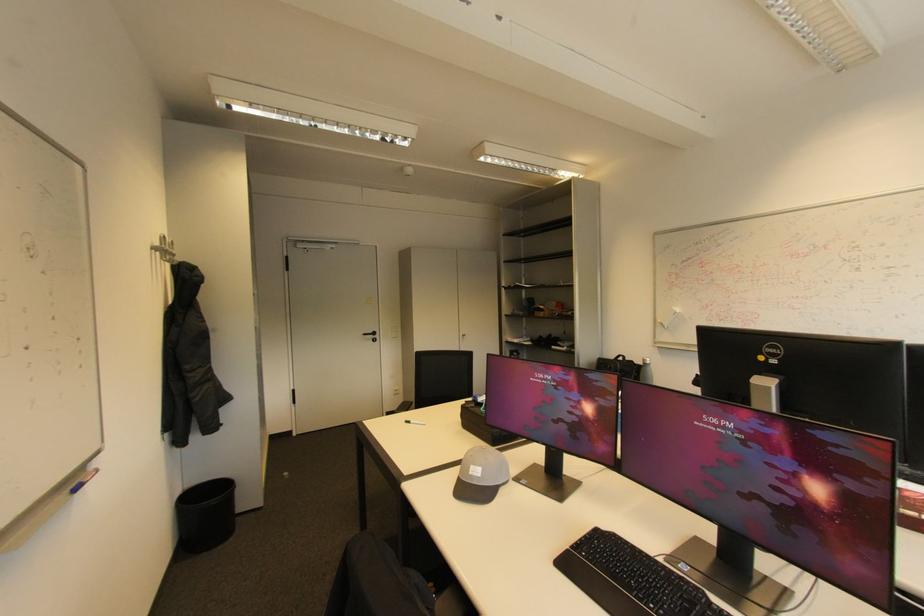
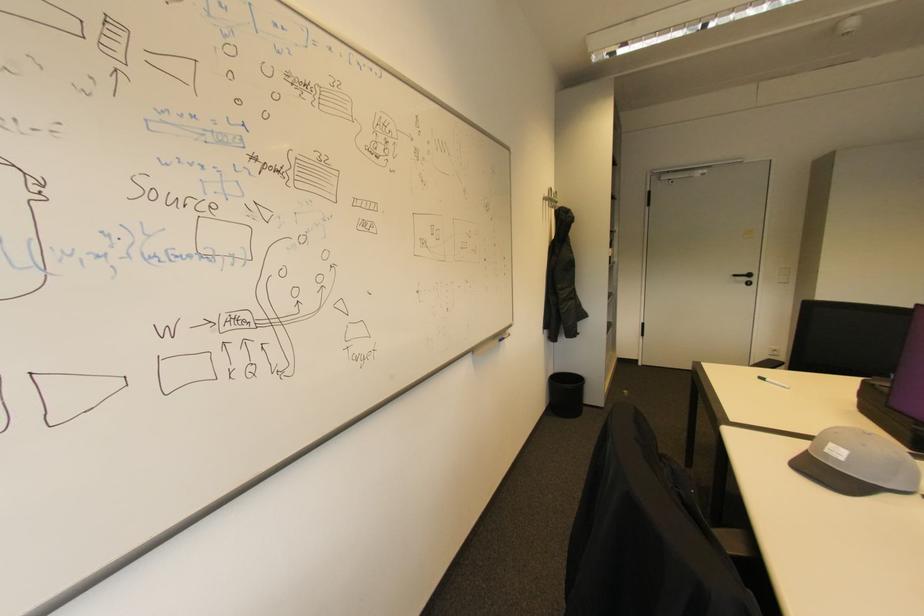
The point at [412,423] is marked in the first image. Where is the corresponding point in the second image?

(768, 379)